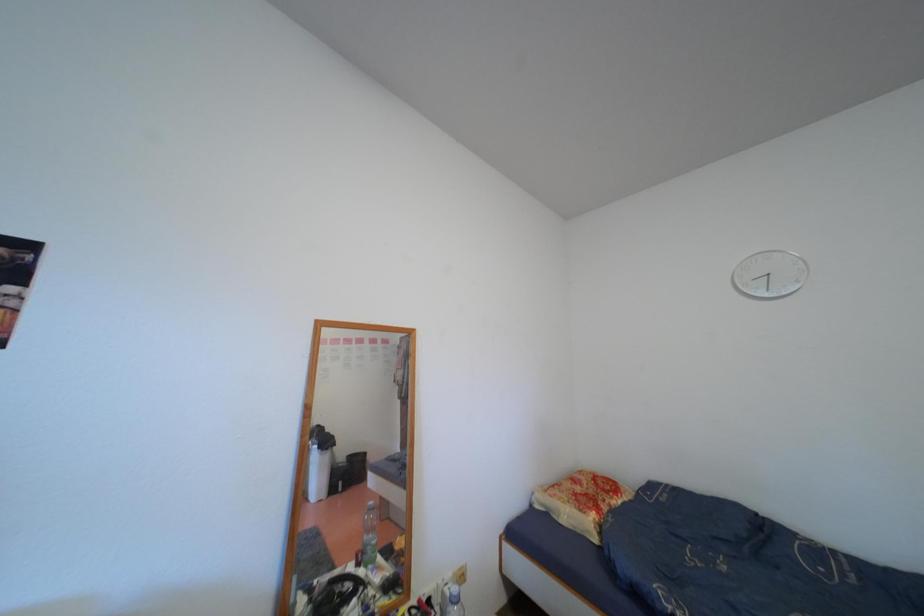
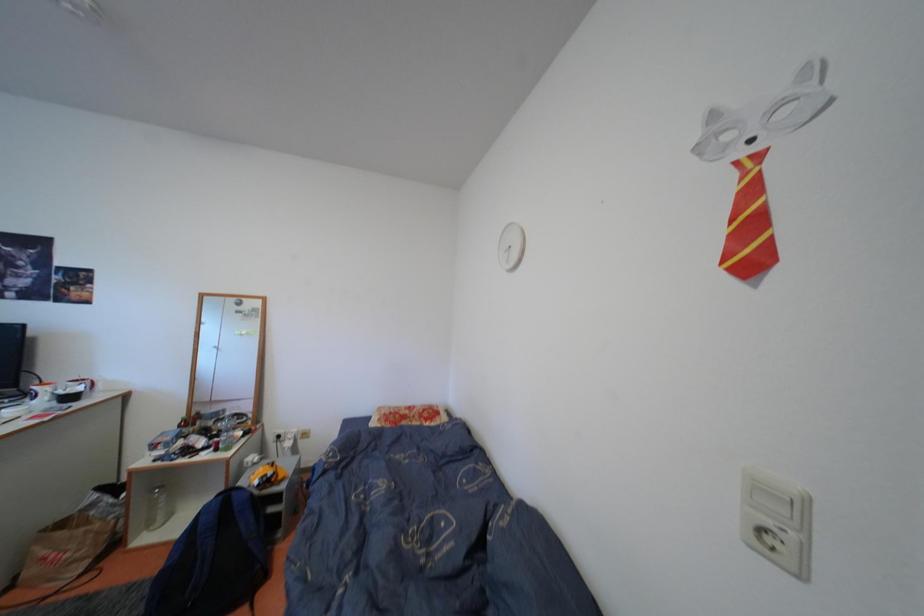
Question: The images are taken continuously from a first-person perspective. In which direction are you moving?

Choices:
 (A) Left
 (B) Right
 (C) Forward
 (D) Backward

Answer: (B)